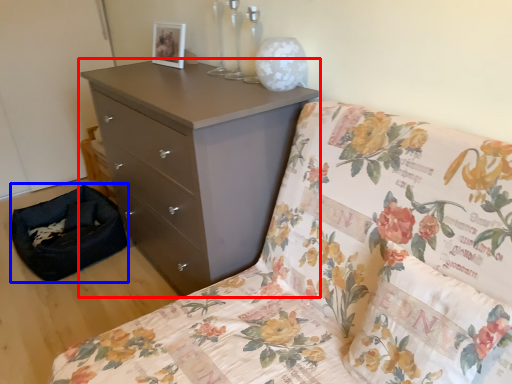
Question: Which of the following is the closest to the observer, chest of drawers (highlighted by a red box) or footrest (highlighted by a blue box)?

Choices:
 (A) chest of drawers
 (B) footrest

Answer: (A)